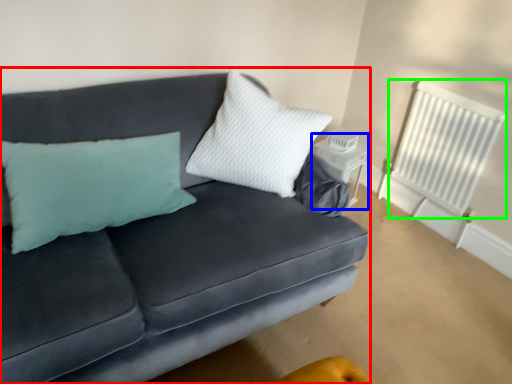
Question: Estimate the real-world distances between objects in this image. Which object is farther from studio couch (highlighted by a red box), table (highlighted by a blue box) or radiator (highlighted by a green box)?

Choices:
 (A) table
 (B) radiator

Answer: (B)